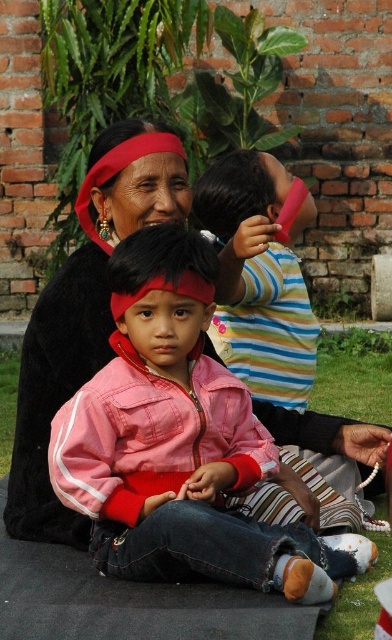
Between pink fabric jacket at center and striped cotton shirt at upper center, which one appears on the right side from the viewer's perspective?

Positioned to the right is striped cotton shirt at upper center.

Does pink fabric jacket at center come behind striped cotton shirt at upper center?

No, pink fabric jacket at center is in front of striped cotton shirt at upper center.

Who is more forward, (335, 566) or (230, 342)?

Point (335, 566) is more forward.

This screenshot has height=640, width=392. Find the location of `pink fabric jacket at center`. pink fabric jacket at center is located at coordinates (177, 442).